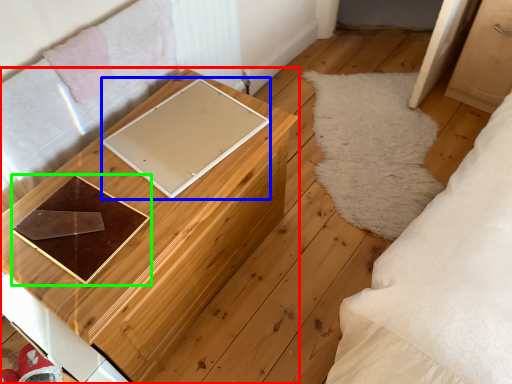
Question: Estimate the real-world distances between objects in this image. Which object is closer to furniture (highlighted by a red box), pad (highlighted by a blue box) or tray (highlighted by a green box)?

Choices:
 (A) pad
 (B) tray

Answer: (A)